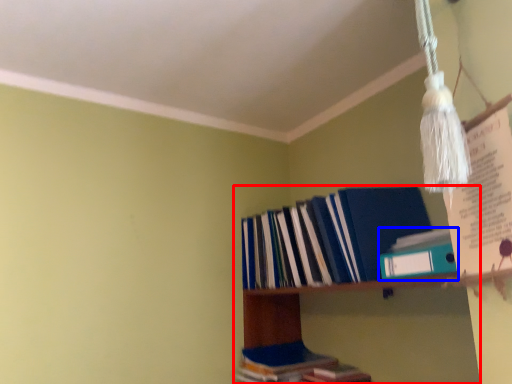
Question: Which object is closer to the camera taking this photo, shelf (highlighted by a red box) or book (highlighted by a blue box)?

Choices:
 (A) shelf
 (B) book

Answer: (A)